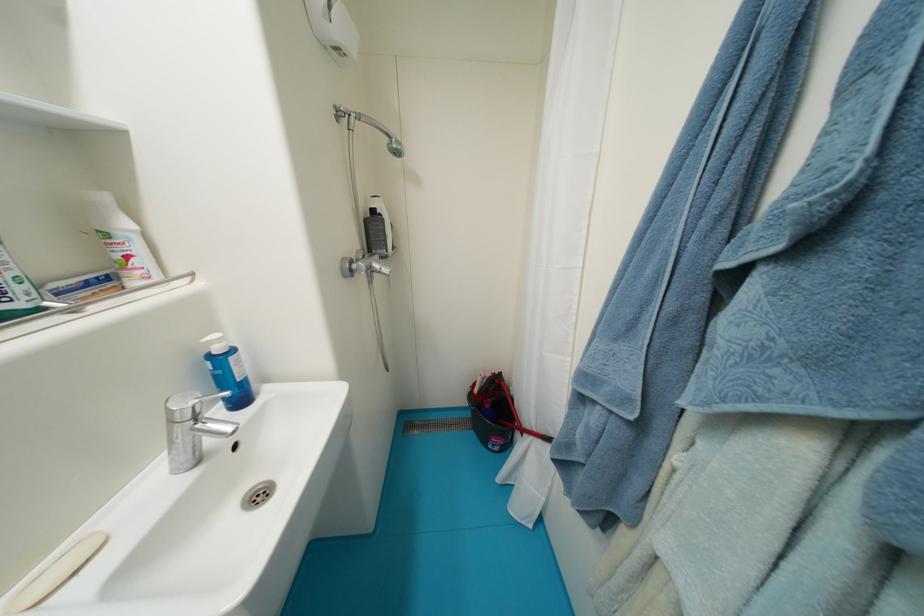
Find the location of a particular element. The height and width of the screenshot is (616, 924). shower control knob is located at coordinates (367, 217).